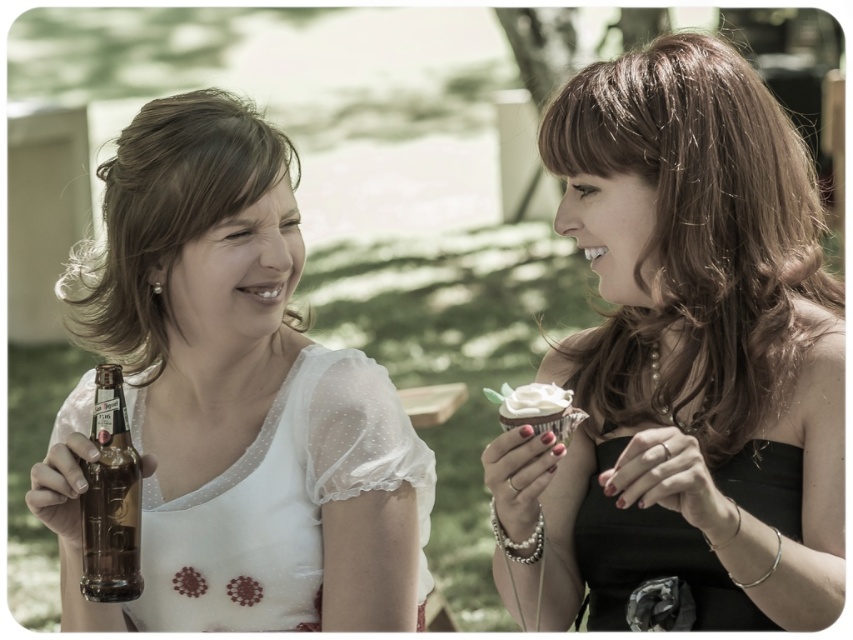
You are a photographer setting up for an outdoor event. You need to position a large backdrop behind the two women in the image. The backdrop is 1.5 meters wide. The matte black dress at right and the matte white blouse at left are part of the scene. Which woman should you place closer to the backdrop to ensure both are fully visible without cropping?

You should place the woman wearing the matte black dress at right closer to the backdrop because it is larger in size than the matte white blouse at left, ensuring both will fit within the 1.5 meter width without being cropped.

You are planning to place both the matte glass beer bottle at left and the white frosted cupcake at right on a shelf. Which item should you place first to ensure they both fit without overlapping?

You should place the matte glass beer bottle at left first because it is taller than the white frosted cupcake at right, so positioning it first ensures there is enough space for both items on the shelf.